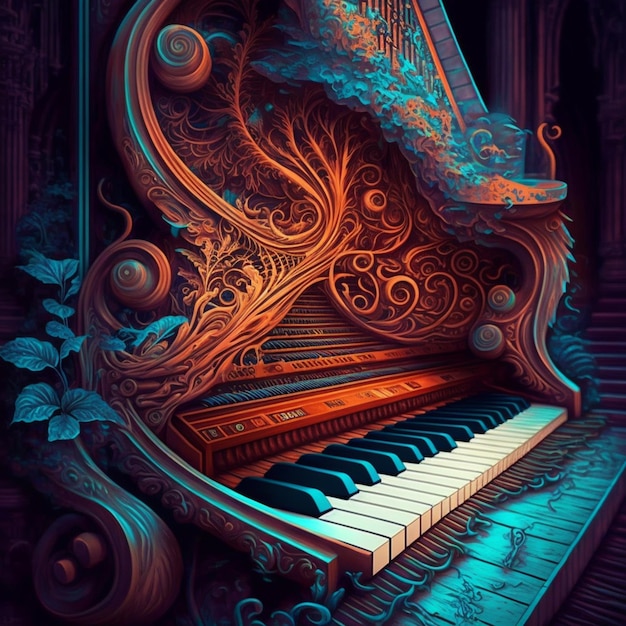
At what (x,y) coordinates should I click in order to perform the action: click on swirly curved piece wood towards the centre left of the image. Please return your answer as a coordinate pair (x, y). Looking at the image, I should click on (123, 277).